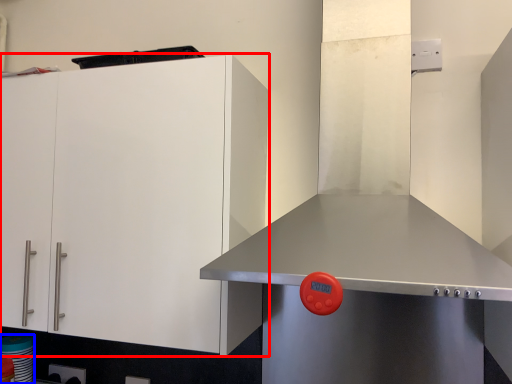
Question: Among these objects, which one is nearest to the camera, cabinetry (highlighted by a red box) or appliance (highlighted by a blue box)?

Choices:
 (A) cabinetry
 (B) appliance

Answer: (A)